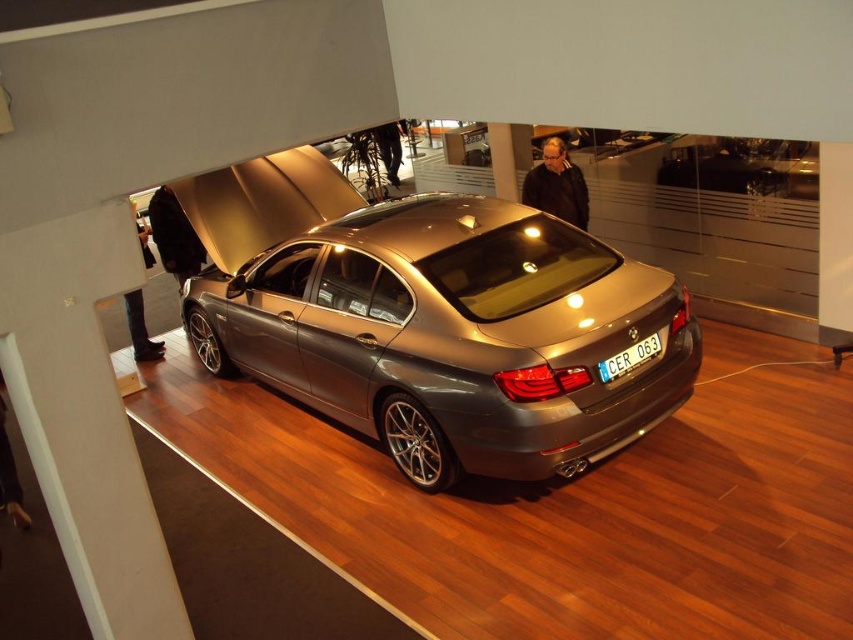
Between point (578, 186) and point (627, 356), which one is positioned in front?

Positioned in front is point (627, 356).

The width and height of the screenshot is (853, 640). Describe the element at coordinates (556, 186) in the screenshot. I see `black leather jacket at upper center` at that location.

Which is in front, point (573, 216) or point (616, 374)?

Point (616, 374) is in front.

Locate an element on the screen. black leather jacket at upper center is located at coordinates (556, 186).

Based on the photo, is satin metallic car at center thinner than dark gray suit at lower left?

In fact, satin metallic car at center might be wider than dark gray suit at lower left.

From the picture: How distant is satin metallic car at center from dark gray suit at lower left?

satin metallic car at center and dark gray suit at lower left are 3.01 meters apart from each other.

Is point (625, 340) closer to viewer compared to point (140, 308)?

Yes.

Locate an element on the screen. The width and height of the screenshot is (853, 640). satin metallic car at center is located at coordinates point(434,317).

Which is in front, point (128, 298) or point (608, 380)?

Point (608, 380) is in front.

Can you confirm if dark gray suit at lower left is wider than white plastic license plate at rear?

No.

Is point (140, 230) positioned in front of point (624, 365)?

No, it is behind (624, 365).

Find the location of `dark gray suit at lower left`. dark gray suit at lower left is located at coordinates (140, 330).